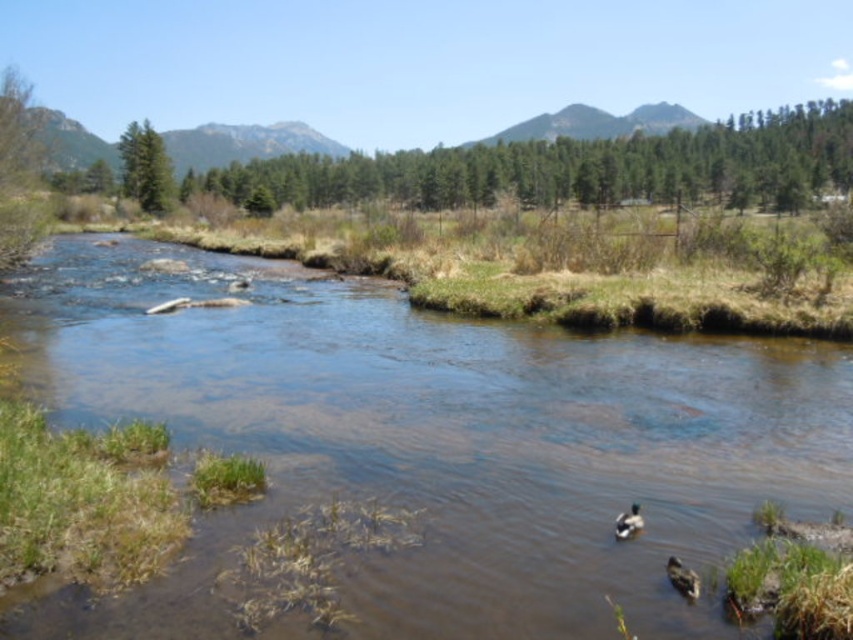
You are standing on the riverbank and want to cross the river to reach the dense evergreen trees in the middle ground. The point marked at coordinates (431, 444) is on clear water at center. Can you safely cross the river at that point?

The point marked at coordinates (431, 444) is on clear water at center, which suggests it is a navigable area of the river. Since the water there is clear and part of the central section, it might be a suitable crossing point. However, the presence of a moderate current and possible submerged rocks could pose risks. Proceed with caution.

You are a photographer trying to capture both the brown matte duck at lower right and the brown fuzzy duck at lower center in a single shot. Which duck should you focus on first to ensure both are in frame?

You should focus on the brown fuzzy duck at lower center first because it is wider than the brown matte duck at lower right, making it easier to position within the frame while still including the smaller duck.

You are a photographer wanting to capture both the clear water at center and the brown fuzzy duck at lower center in your shot. Which object will occupy a larger portion of the image?

The clear water at center is bigger than the brown fuzzy duck at lower center, so it will occupy a larger portion of the image.